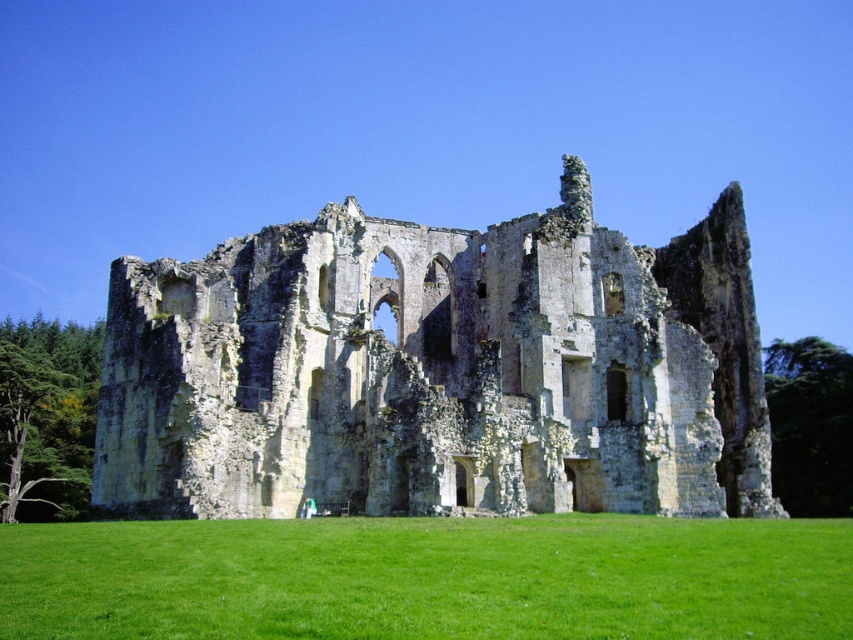
Which is below, yellow stone ruins at center or green grass at center?

green grass at center is lower down.

Who is positioned more to the left, yellow stone ruins at center or green grass at center?

yellow stone ruins at center is more to the left.

This screenshot has width=853, height=640. I want to click on yellow stone ruins at center, so pos(438,371).